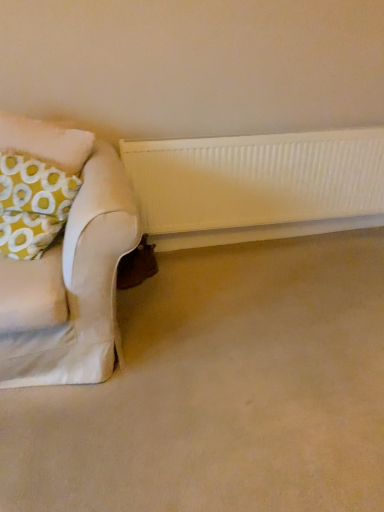
Question: From a real-world perspective, is yellow fabric pillow at left on top of white ribbed radiator at center?

Choices:
 (A) yes
 (B) no

Answer: (A)

Question: Considering the relative sizes of yellow fabric pillow at left and white ribbed radiator at center in the image provided, is yellow fabric pillow at left taller than white ribbed radiator at center?

Choices:
 (A) yes
 (B) no

Answer: (B)

Question: From a real-world perspective, is yellow fabric pillow at left under white ribbed radiator at center?

Choices:
 (A) yes
 (B) no

Answer: (B)

Question: Can you confirm if yellow fabric pillow at left is positioned to the left of white ribbed radiator at center?

Choices:
 (A) no
 (B) yes

Answer: (B)

Question: Does yellow fabric pillow at left contain white ribbed radiator at center?

Choices:
 (A) yes
 (B) no

Answer: (B)

Question: Is yellow fabric pillow at left facing towards white ribbed radiator at center?

Choices:
 (A) yes
 (B) no

Answer: (B)

Question: Is white ribbed radiator at center at the left side of white textured radiator at lower center?

Choices:
 (A) yes
 (B) no

Answer: (A)

Question: Is white ribbed radiator at center positioned with its back to white textured radiator at lower center?

Choices:
 (A) yes
 (B) no

Answer: (A)

Question: Is white ribbed radiator at center at the right side of white textured radiator at lower center?

Choices:
 (A) yes
 (B) no

Answer: (B)

Question: Is white ribbed radiator at center shorter than white textured radiator at lower center?

Choices:
 (A) yes
 (B) no

Answer: (B)

Question: From a real-world perspective, is white ribbed radiator at center positioned under white textured radiator at lower center based on gravity?

Choices:
 (A) no
 (B) yes

Answer: (A)

Question: Would you say white textured radiator at lower center is part of white ribbed radiator at center's contents?

Choices:
 (A) yes
 (B) no

Answer: (B)

Question: From the image's perspective, is white textured radiator at lower center located above yellow fabric pillow at left?

Choices:
 (A) no
 (B) yes

Answer: (A)